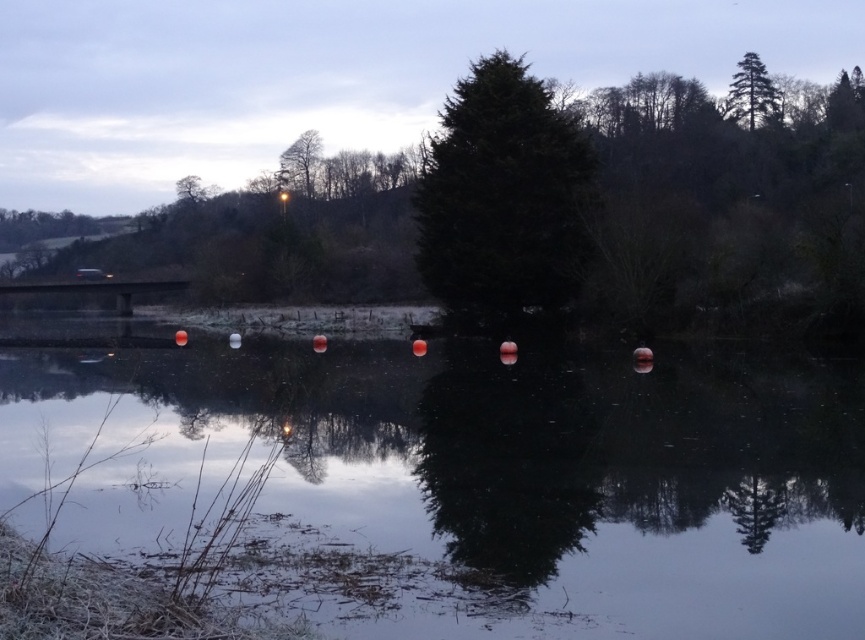
You are standing at the edge of the water and want to take a photo of the dark green textured tree at center. Which direction should you face to ensure the tree is in the center of your camera frame?

Since the dark green textured tree at center is located at point coordinates, you should face directly towards the center of the scene to capture it in the center of your camera frame.

You are a hiker planning to cross the transparent glass river at center and the green matte tree at upper center. Which object is wider from your perspective?

The transparent glass river at center is wider than the green matte tree at upper center according to the description.

You are standing at the center of the bridge and looking towards the green textured pine tree at upper right. What is the direction you need to look to see it?

The green textured pine tree at upper right is located at coordinates 0.144 on the x axis and 0.869 on the y axis, so you need to look to the upper right direction to see it.